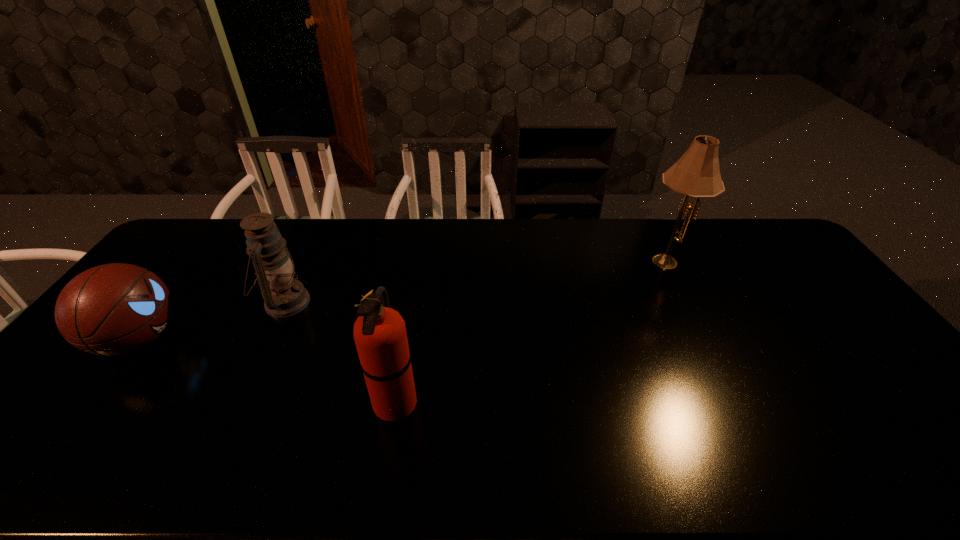
Where is `vacant space situated on the front of the third object from right to left`? vacant space situated on the front of the third object from right to left is located at coordinates (219, 442).

At what (x,y) coordinates should I click in order to perform the action: click on vacant region located 0.320m on the right of the basketball. Please return your answer as a coordinate pair (x, y). The width and height of the screenshot is (960, 540). Looking at the image, I should click on (295, 339).

Where is `object located at the far edge`? The image size is (960, 540). object located at the far edge is located at coordinates (697, 174).

The height and width of the screenshot is (540, 960). What are the coordinates of `object located in the left edge section of the desktop` in the screenshot? It's located at (113, 309).

Image resolution: width=960 pixels, height=540 pixels. I want to click on vacant space at the far edge of the desktop, so click(552, 228).

Image resolution: width=960 pixels, height=540 pixels. In order to click on vacant point at the near edge in this screenshot , I will do `click(849, 451)`.

Image resolution: width=960 pixels, height=540 pixels. I want to click on free space at the left edge, so click(x=113, y=379).

At what (x,y) coordinates should I click in order to perform the action: click on vacant space at the right edge of the desktop. Please return your answer as a coordinate pair (x, y). Image resolution: width=960 pixels, height=540 pixels. Looking at the image, I should click on (872, 368).

The width and height of the screenshot is (960, 540). Identify the location of vacant space at the far left corner. (201, 253).

The image size is (960, 540). Identify the location of free space between the oil lamp and the lampshade. (476, 280).